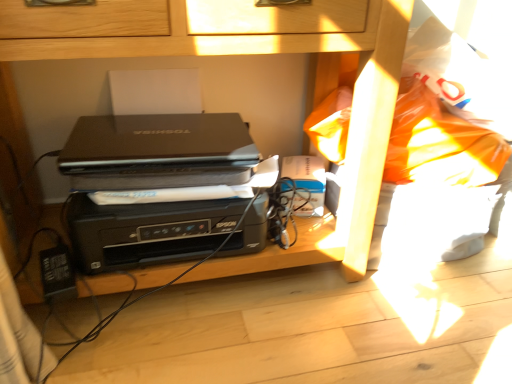
Question: From the image's perspective, does matte black laptop at center appear higher than black plastic printer at center?

Choices:
 (A) no
 (B) yes

Answer: (A)

Question: Can you confirm if matte black laptop at center is taller than black plastic printer at center?

Choices:
 (A) yes
 (B) no

Answer: (B)

Question: Is matte black laptop at center shorter than black plastic printer at center?

Choices:
 (A) yes
 (B) no

Answer: (A)

Question: From a real-world perspective, is matte black laptop at center under black plastic printer at center?

Choices:
 (A) no
 (B) yes

Answer: (B)

Question: Is black plastic printer at center a part of matte black laptop at center?

Choices:
 (A) yes
 (B) no

Answer: (B)

Question: Is matte black laptop at center at the left side of black plastic printer at center?

Choices:
 (A) yes
 (B) no

Answer: (A)

Question: Is black plastic printer at center behind matte black laptop at center?

Choices:
 (A) yes
 (B) no

Answer: (B)

Question: Can you confirm if black plastic printer at center is wider than matte black laptop at center?

Choices:
 (A) no
 (B) yes

Answer: (B)

Question: Is black plastic printer at center at the left side of matte black laptop at center?

Choices:
 (A) no
 (B) yes

Answer: (A)

Question: From the image's perspective, is black plastic printer at center located above matte black laptop at center?

Choices:
 (A) no
 (B) yes

Answer: (B)

Question: Considering the relative sizes of black plastic printer at center and matte black laptop at center in the image provided, is black plastic printer at center taller than matte black laptop at center?

Choices:
 (A) no
 (B) yes

Answer: (B)

Question: From the image's perspective, does black plastic printer at center appear lower than matte black laptop at center?

Choices:
 (A) no
 (B) yes

Answer: (A)

Question: Is black plastic printer at center smaller than black matte laptop at center?

Choices:
 (A) yes
 (B) no

Answer: (B)